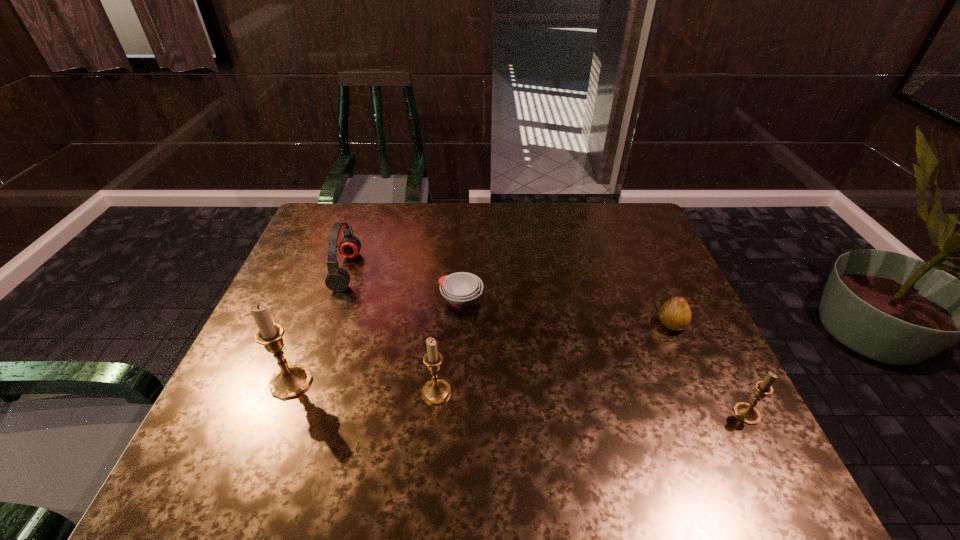
Locate an element on the screen. The height and width of the screenshot is (540, 960). object at the near right corner is located at coordinates (747, 413).

Identify the location of blank space at the far edge. Image resolution: width=960 pixels, height=540 pixels. (461, 217).

You are a GUI agent. You are given a task and a screenshot of the screen. Output one action in this format:
    pyautogui.click(x=<x>, y=<y>)
    Task: Click on the vacant space at the near edge of the desktop
    This screenshot has width=960, height=540.
    Given the screenshot: What is the action you would take?
    pyautogui.click(x=658, y=432)

This screenshot has height=540, width=960. In order to click on vacant space at the left edge of the desktop in this screenshot , I will do `click(302, 281)`.

Locate an element on the screen. vacant region at the right edge of the desktop is located at coordinates (662, 281).

The width and height of the screenshot is (960, 540). Identify the location of free region at the far right corner of the desktop. (614, 243).

Where is `vacant point at the near right corner`? vacant point at the near right corner is located at coordinates (700, 421).

Image resolution: width=960 pixels, height=540 pixels. I want to click on free area in between the tallest candle holder and the shortest candle holder, so click(518, 398).

Find the location of `vacant space in between the earphone and the leftmost candle holder`. vacant space in between the earphone and the leftmost candle holder is located at coordinates (319, 327).

Locate an element on the screen. This screenshot has height=540, width=960. empty space between the rightmost candle holder and the soup bowl is located at coordinates (604, 357).